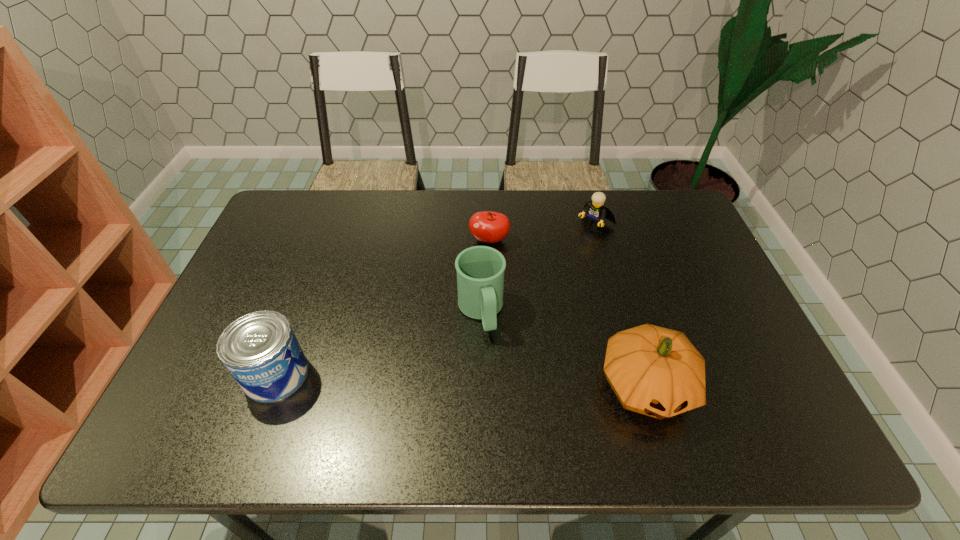
Image resolution: width=960 pixels, height=540 pixels. I want to click on vacant space on the desktop that is between the can and the gourd and is positioned on the stem of the apple, so click(446, 380).

The width and height of the screenshot is (960, 540). What are the coordinates of `vacant space on the desktop that is between the leftmost object and the gourd and is positioned on the front-facing side of the Lego` in the screenshot? It's located at (429, 379).

Find the location of a particular element. free space on the desktop that is between the can and the gourd and is positioned on the side of the third nearest object with the handle is located at coordinates (499, 381).